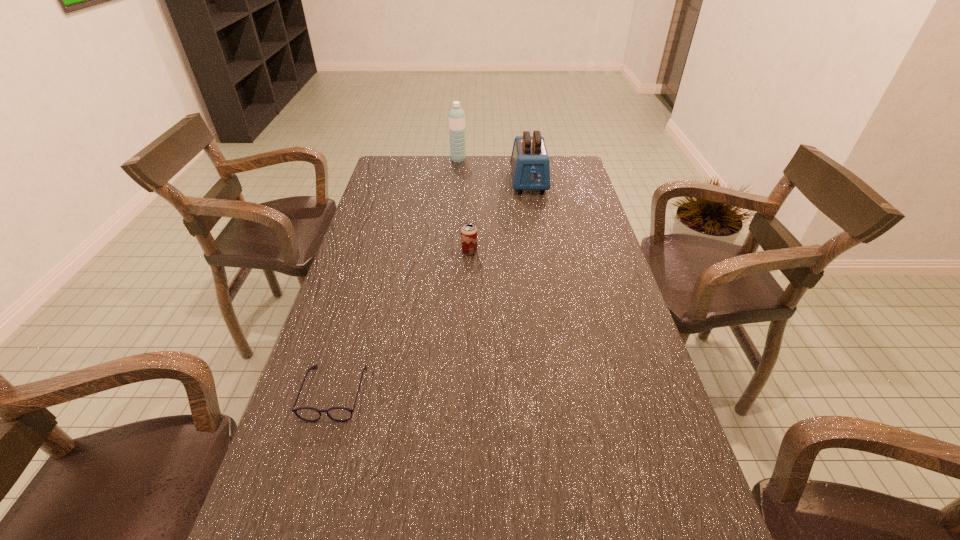
Where is `object that is the second closest to the farthest object`? object that is the second closest to the farthest object is located at coordinates (468, 231).

At what (x,y) coordinates should I click in order to perform the action: click on object that ranks as the third closest to the second object from left to right. Please return your answer as a coordinate pair (x, y). Looking at the image, I should click on (340, 414).